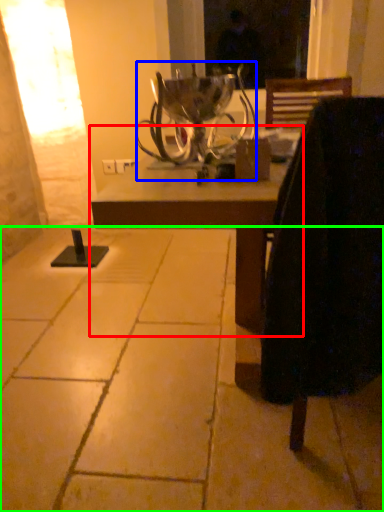
Question: Considering the real-world distances, which object is closest to table (highlighted by a red box)? candle holder (highlighted by a blue box) or concrete (highlighted by a green box).

Choices:
 (A) candle holder
 (B) concrete

Answer: (B)